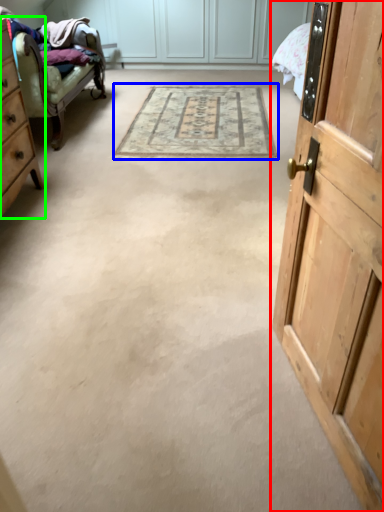
Question: Estimate the real-world distances between objects in this image. Which object is farther from door (highlighted by a red box), mat (highlighted by a blue box) or cabinetry (highlighted by a green box)?

Choices:
 (A) mat
 (B) cabinetry

Answer: (A)